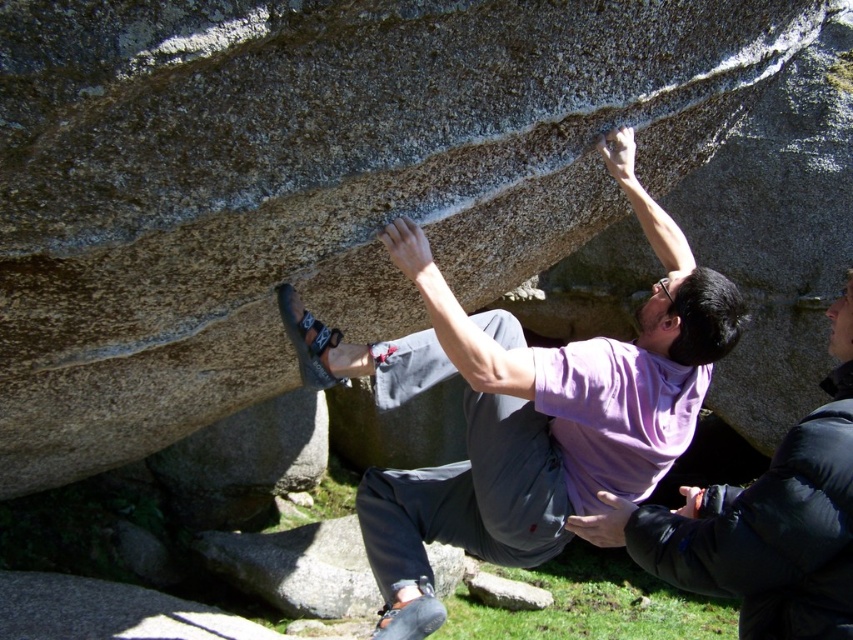
Can you confirm if purple matte shirt at upper center is positioned below gray rough rock at lower center?

Actually, purple matte shirt at upper center is above gray rough rock at lower center.

Does purple matte shirt at upper center have a greater height compared to gray rough rock at lower center?

Indeed, purple matte shirt at upper center has a greater height compared to gray rough rock at lower center.

Who is more distant from viewer, (801, 602) or (473, 595)?

Positioned behind is point (473, 595).

Where is `purple matte shirt at upper center`? Image resolution: width=853 pixels, height=640 pixels. purple matte shirt at upper center is located at coordinates (763, 522).

Is purple cotton shirt at center above gray rough rock at lower center?

Yes, purple cotton shirt at center is above gray rough rock at lower center.

I want to click on purple cotton shirt at center, so click(x=523, y=410).

Locate an element on the screen. The image size is (853, 640). purple cotton shirt at center is located at coordinates (523, 410).

Does purple cotton shirt at center appear on the right side of purple matte shirt at upper center?

In fact, purple cotton shirt at center is to the left of purple matte shirt at upper center.

Which is more to the right, purple cotton shirt at center or purple matte shirt at upper center?

Positioned to the right is purple matte shirt at upper center.

The image size is (853, 640). I want to click on purple cotton shirt at center, so click(x=523, y=410).